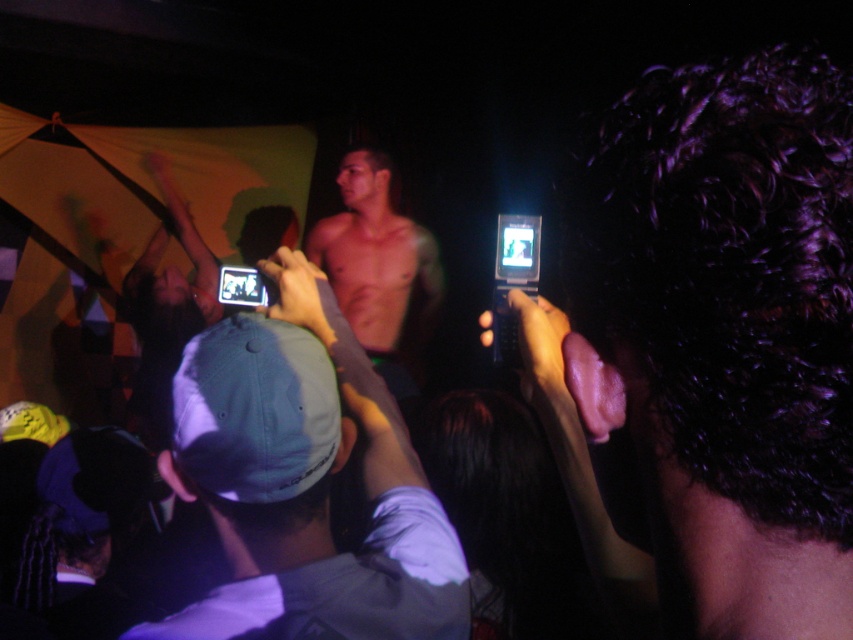
Question: Is shiny black phone at center bigger than smooth skin torso at center?

Choices:
 (A) no
 (B) yes

Answer: (A)

Question: Based on their relative distances, which object is nearer to the shiny black phone at center?

Choices:
 (A) smooth skin torso at center
 (B) gray fabric cap at center

Answer: (B)

Question: Estimate the real-world distances between objects in this image. Which object is closer to the gray fabric cap at center?

Choices:
 (A) shiny black phone at center
 (B) smooth skin torso at center

Answer: (A)

Question: From the image, what is the correct spatial relationship of shiny black phone at center in relation to gray fabric cap at center?

Choices:
 (A) below
 (B) above

Answer: (B)

Question: Which point is farther from the camera taking this photo?

Choices:
 (A) coord(668,608)
 (B) coord(399,336)

Answer: (B)

Question: Is shiny black phone at center further to camera compared to smooth skin torso at center?

Choices:
 (A) yes
 (B) no

Answer: (B)